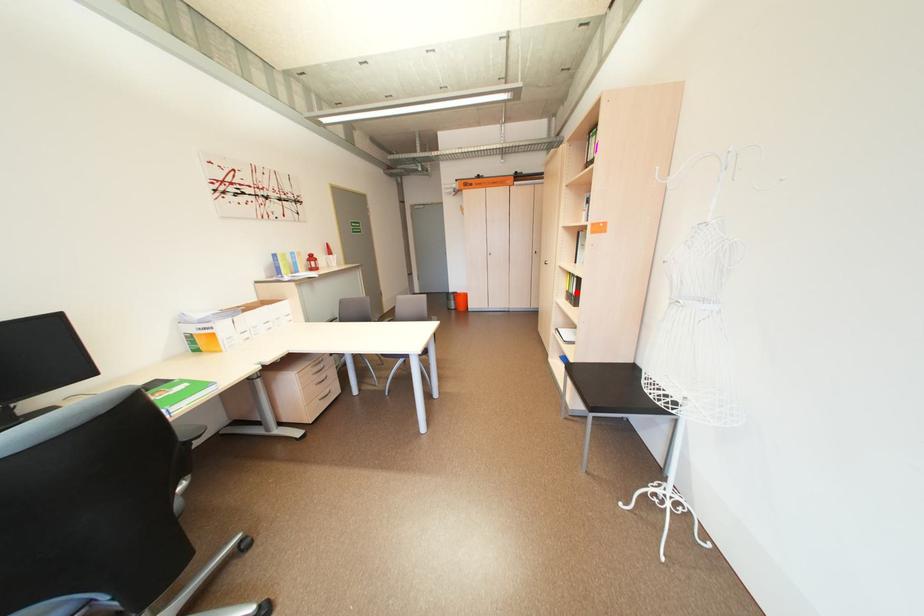
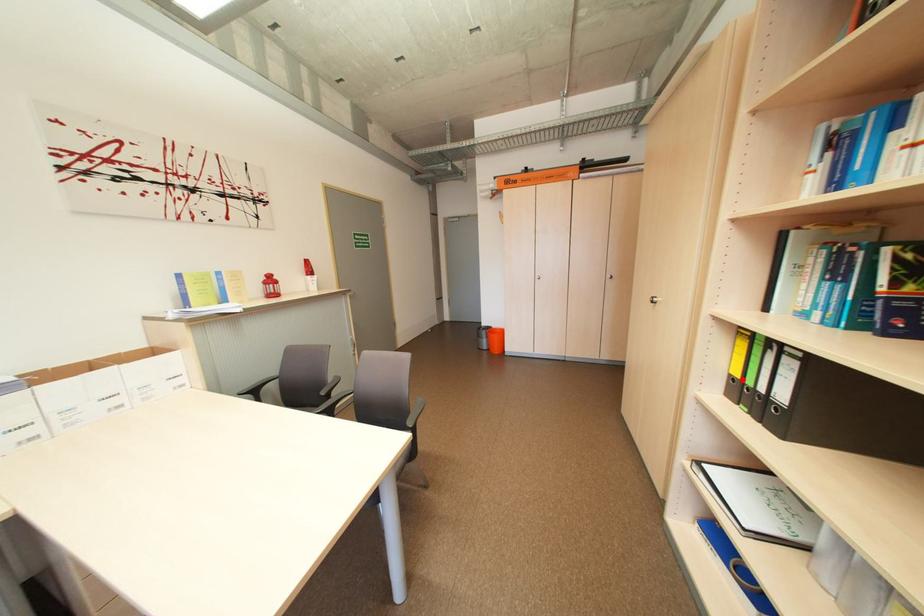
Based on the photo, I am providing you with two images of the same scene from different viewpoints. A red point is marked on the first image and another point is marked on the second image. Is the marked point in image1 the same physical position as the marked point in image2?

Yes